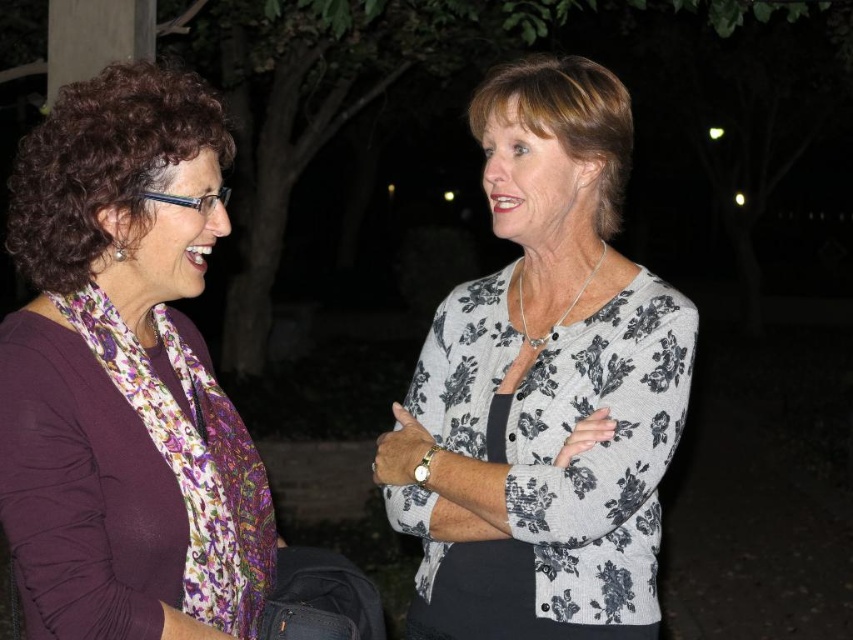
Does purple matte scarf at left appear on the left side of floral-patterned cardigan at center?

Correct, you'll find purple matte scarf at left to the left of floral-patterned cardigan at center.

What do you see at coordinates (138, 390) in the screenshot? I see `purple matte scarf at left` at bounding box center [138, 390].

Find the location of `purple matte scarf at left`. purple matte scarf at left is located at coordinates (138, 390).